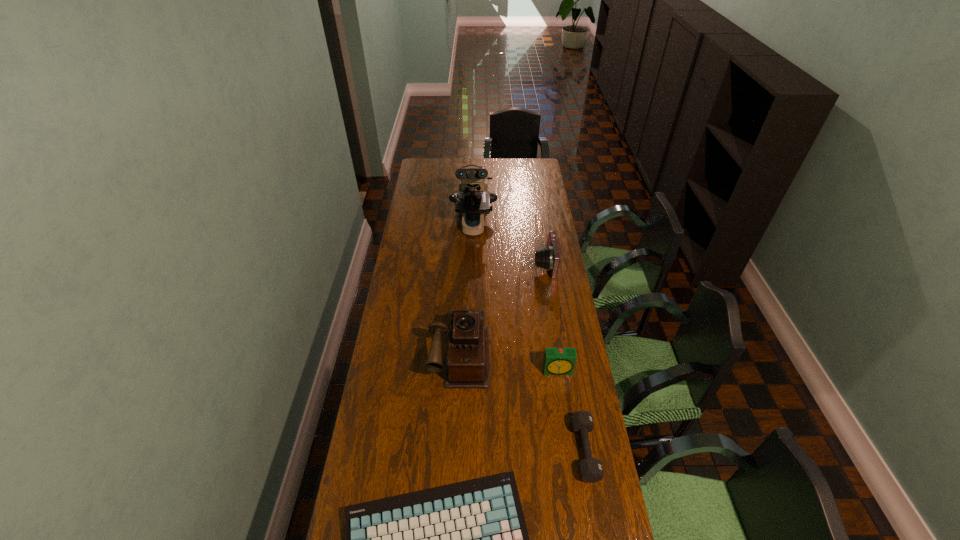
The height and width of the screenshot is (540, 960). What are the coordinates of `free point between the alarm clock and the phonograph_record` in the screenshot? It's located at (509, 362).

Where is `vacant space that's between the microscope and the fifth tallest object`? This screenshot has height=540, width=960. vacant space that's between the microscope and the fifth tallest object is located at coordinates (529, 338).

In order to click on empty space between the phonograph_record and the second shortest object in this screenshot , I will do `click(522, 402)`.

Find the location of a particular element. The image size is (960, 540). object that is the fourth closest to the microscope is located at coordinates (590, 469).

What are the coordinates of `object that stands as the third closest to the shortest object` in the screenshot? It's located at (557, 361).

This screenshot has height=540, width=960. I want to click on vacant space that satisfies the following two spatial constraints: 1. on the front-facing side of the alarm clock; 2. on the left side of the dumbbell, so click(x=570, y=450).

I want to click on free space that satisfies the following two spatial constraints: 1. on the front-facing side of the camera; 2. on the left side of the dumbbell, so click(x=573, y=450).

You are a GUI agent. You are given a task and a screenshot of the screen. Output one action in this format:
    pyautogui.click(x=<x>, y=<y>)
    Task: Click on the free location that satisfies the following two spatial constraints: 1. through the eyepieces of the fifth tallest object; 2. on the right side of the tallest object
    The width and height of the screenshot is (960, 540).
    Given the screenshot: What is the action you would take?
    [469, 450]

You are a GUI agent. You are given a task and a screenshot of the screen. Output one action in this format:
    pyautogui.click(x=<x>, y=<y>)
    Task: Click on the free space that satisfies the following two spatial constraints: 1. on the front-facing side of the camera; 2. on the horn of the phonograph_record
    
    Given the screenshot: What is the action you would take?
    pyautogui.click(x=558, y=353)